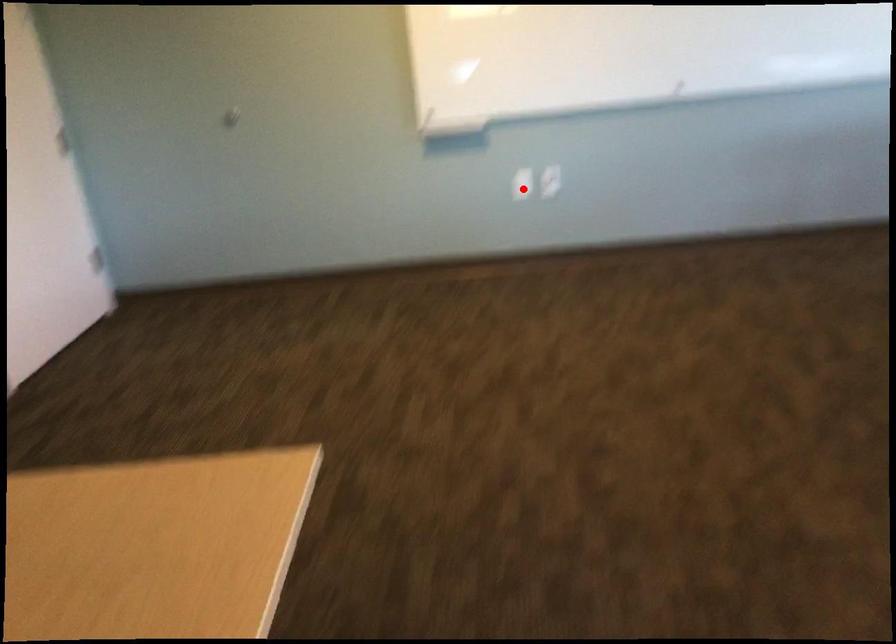
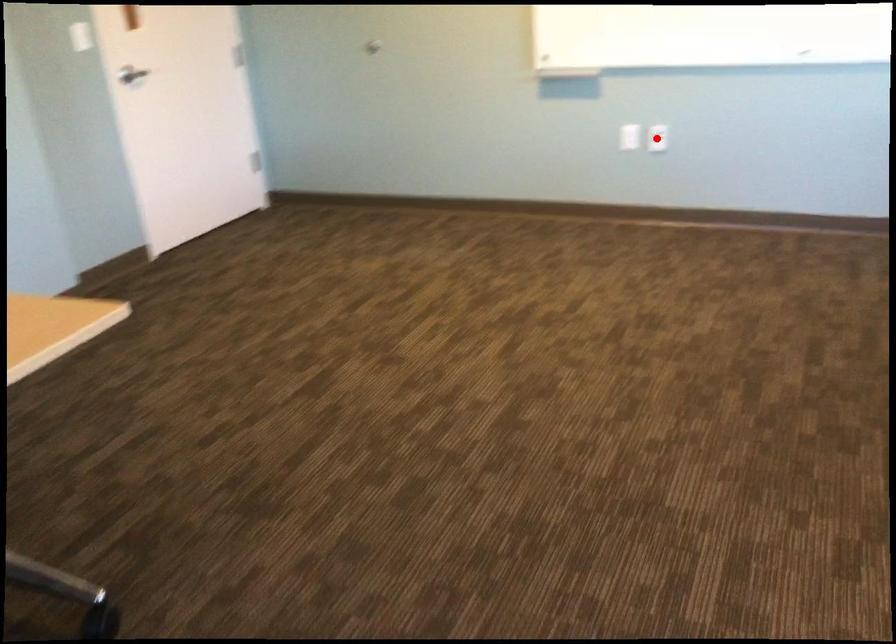
I am providing you with two images of the same scene from different viewpoints. A red point is marked on the first image and another point is marked on the second image. Does the point marked in image1 correspond to the same location as the one in image2?

No